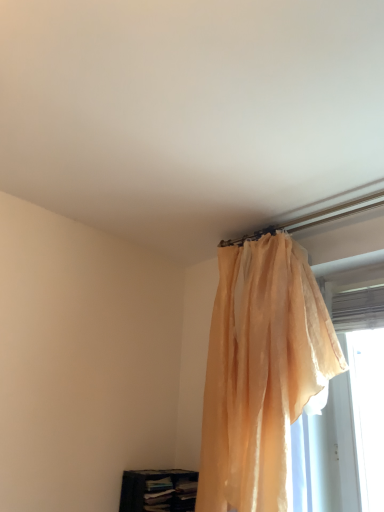
Question: Is translucent fabric at right positioned before dark blue fabric bookshelf at lower left?

Choices:
 (A) yes
 (B) no

Answer: (A)

Question: Can you confirm if translucent fabric at right is bigger than dark blue fabric bookshelf at lower left?

Choices:
 (A) no
 (B) yes

Answer: (B)

Question: Is translucent fabric at right located outside dark blue fabric bookshelf at lower left?

Choices:
 (A) no
 (B) yes

Answer: (B)

Question: Is dark blue fabric bookshelf at lower left a part of translucent fabric at right?

Choices:
 (A) yes
 (B) no

Answer: (B)

Question: Is translucent fabric at right shorter than dark blue fabric bookshelf at lower left?

Choices:
 (A) yes
 (B) no

Answer: (B)

Question: Considering the relative positions of translucent fabric at right and dark blue fabric bookshelf at lower left in the image provided, is translucent fabric at right to the right of dark blue fabric bookshelf at lower left from the viewer's perspective?

Choices:
 (A) no
 (B) yes

Answer: (B)

Question: From the image's perspective, does translucent fabric at right appear lower than translucent peach curtain at upper right?

Choices:
 (A) no
 (B) yes

Answer: (A)

Question: Considering the relative positions of translucent fabric at right and translucent peach curtain at upper right in the image provided, is translucent fabric at right to the right of translucent peach curtain at upper right from the viewer's perspective?

Choices:
 (A) no
 (B) yes

Answer: (B)

Question: Are translucent fabric at right and translucent peach curtain at upper right located far from each other?

Choices:
 (A) yes
 (B) no

Answer: (B)

Question: Can you confirm if translucent fabric at right is wider than translucent peach curtain at upper right?

Choices:
 (A) yes
 (B) no

Answer: (B)

Question: Is translucent fabric at right with translucent peach curtain at upper right?

Choices:
 (A) yes
 (B) no

Answer: (B)

Question: Can you confirm if translucent fabric at right is thinner than translucent peach curtain at upper right?

Choices:
 (A) yes
 (B) no

Answer: (A)

Question: Is translucent peach curtain at upper right wider than translucent fabric at right?

Choices:
 (A) yes
 (B) no

Answer: (A)